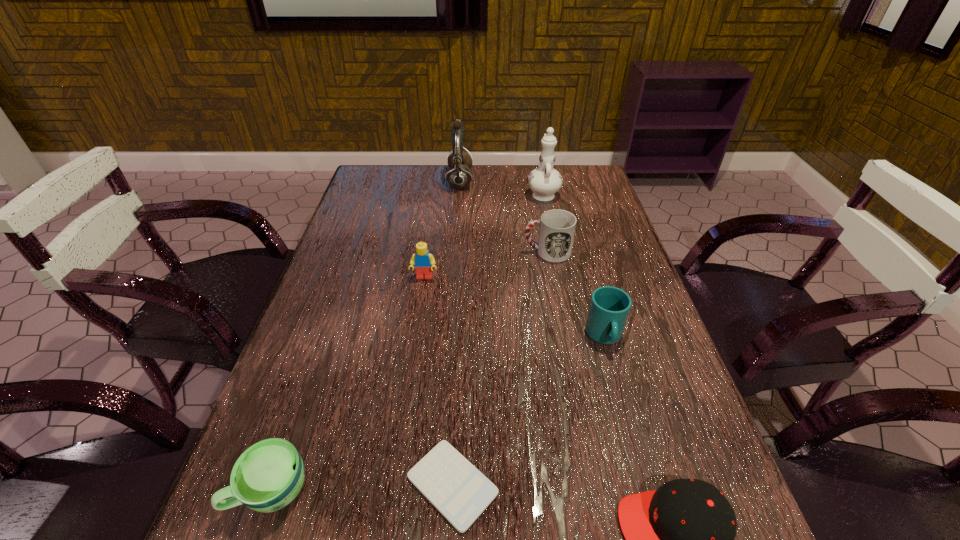
This screenshot has width=960, height=540. What are the coordinates of `free area in between the fourth nearest object and the earphone` in the screenshot? It's located at (532, 259).

This screenshot has width=960, height=540. What are the coordinates of `free space between the shortest object and the fourth farthest object` in the screenshot? It's located at (439, 381).

Find the location of a particular element. free space that is in between the earphone and the farthest cup is located at coordinates (503, 217).

At what (x,y) coordinates should I click in order to perform the action: click on vacant area that lies between the earphone and the second farthest cup. Please return your answer as a coordinate pair (x, y). Image resolution: width=960 pixels, height=540 pixels. Looking at the image, I should click on (532, 259).

Locate an element on the screen. The width and height of the screenshot is (960, 540). vacant area between the fourth farthest object and the chinaware is located at coordinates (484, 235).

The image size is (960, 540). Identify the location of vacant space in between the earphone and the shortest cup. (366, 335).

Image resolution: width=960 pixels, height=540 pixels. I want to click on the third closest object to the chinaware, so click(423, 261).

Locate an element on the screen. The width and height of the screenshot is (960, 540). object that stands as the second closest to the earphone is located at coordinates (557, 227).

The height and width of the screenshot is (540, 960). Find the location of `the closest cup relative to the earphone`. the closest cup relative to the earphone is located at coordinates (557, 227).

The width and height of the screenshot is (960, 540). Identify the location of cup that is the second closest to the earphone. (609, 308).